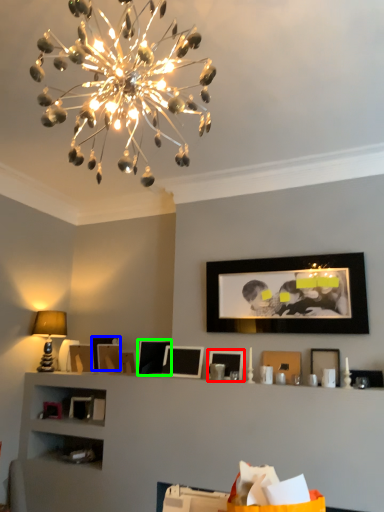
Question: Based on their relative distances, which object is nearer to picture frame (highlighted by a red box)? Choose from picture frame (highlighted by a blue box) and picture frame (highlighted by a green box).

Choices:
 (A) picture frame
 (B) picture frame

Answer: (B)